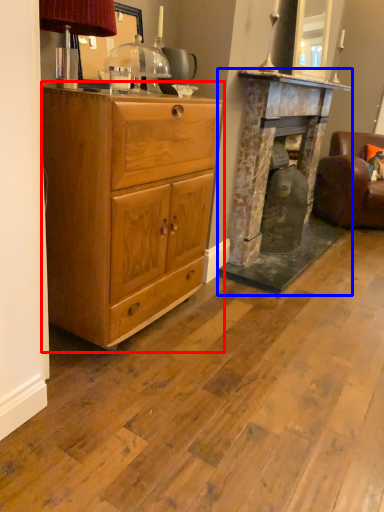
Question: Which object is closer to the camera taking this photo, chest of drawers (highlighted by a red box) or fireplace (highlighted by a blue box)?

Choices:
 (A) chest of drawers
 (B) fireplace

Answer: (A)